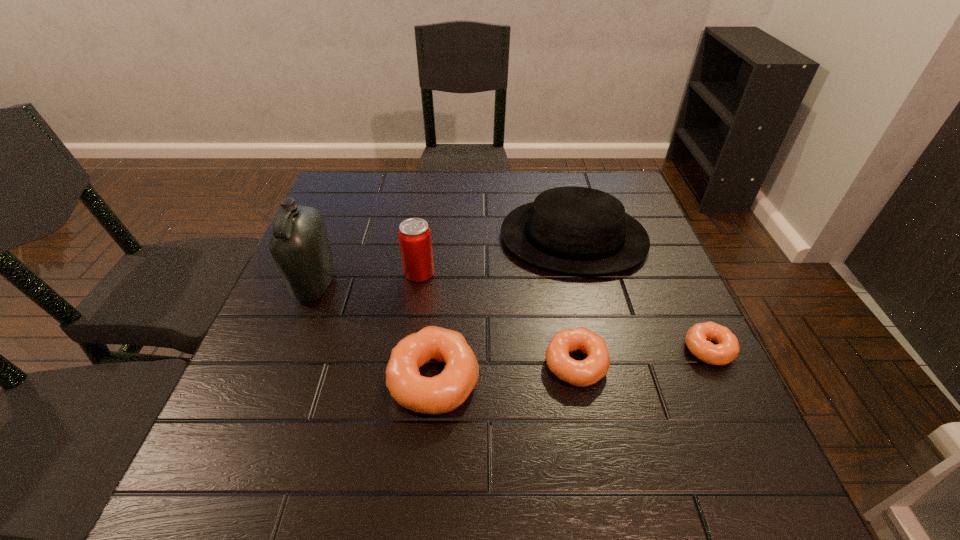
You are a GUI agent. You are given a task and a screenshot of the screen. Output one action in this format:
    pyautogui.click(x=<x>, y=<y>)
    Task: Click on the free spot located on the left of the fourth tallest object
    The height and width of the screenshot is (540, 960).
    Given the screenshot: What is the action you would take?
    pyautogui.click(x=238, y=380)

Image resolution: width=960 pixels, height=540 pixels. In order to click on vacant region located 0.260m on the left of the second tallest doughnut in this screenshot , I will do `click(413, 364)`.

Identify the location of vacant space located on the left of the shortest object. The height and width of the screenshot is (540, 960). (521, 349).

You are a GUI agent. You are given a task and a screenshot of the screen. Output one action in this format:
    pyautogui.click(x=<x>, y=<y>)
    Task: Click on the free space located on the front of the bottle
    
    Given the screenshot: What is the action you would take?
    pyautogui.click(x=299, y=328)

Locate an element on the screen. blank space located 0.180m on the left of the can is located at coordinates (329, 273).

Identify the location of vacant region located 0.340m on the front of the fedora. (615, 407).

You are a GUI agent. You are given a task and a screenshot of the screen. Output one action in this format:
    pyautogui.click(x=<x>, y=<y>)
    Task: Click on the object that is at the far edge
    
    Given the screenshot: What is the action you would take?
    pyautogui.click(x=578, y=230)

At what (x,y) coordinates should I click in order to perform the action: click on object at the near edge. Please return your answer as a coordinate pair (x, y). Looking at the image, I should click on (443, 393).

Image resolution: width=960 pixels, height=540 pixels. Find the location of `object located at the left edge`. object located at the left edge is located at coordinates (300, 246).

Where is `doughnut positioned at the right edge`? This screenshot has width=960, height=540. doughnut positioned at the right edge is located at coordinates (727, 348).